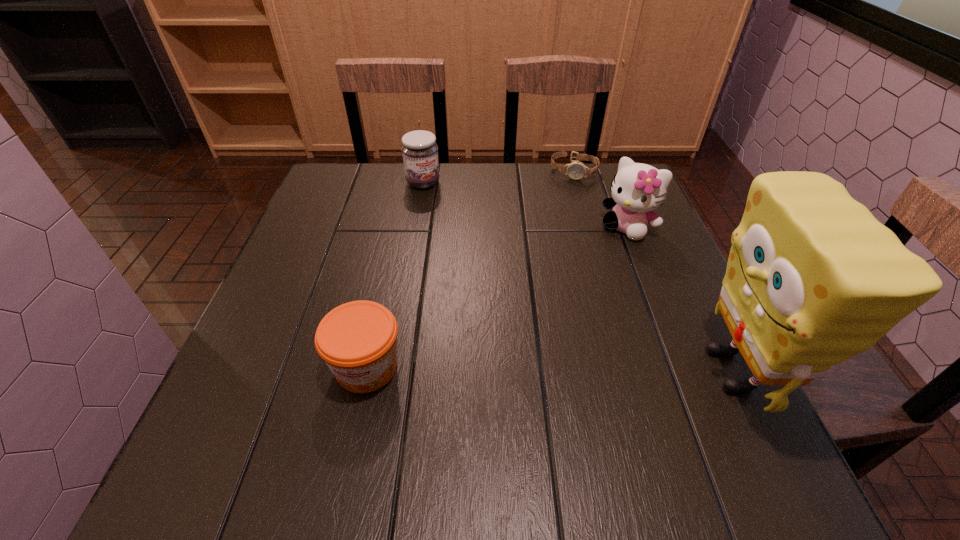
The width and height of the screenshot is (960, 540). Find the location of `free spot on the desktop that is between the fourth tallest object and the sponge and is positioned on the front-facing side of the third farthest object`. free spot on the desktop that is between the fourth tallest object and the sponge and is positioned on the front-facing side of the third farthest object is located at coordinates (508, 368).

Where is `free space on the desktop that is between the shorter jam and the tallest object and is positioned on the face of the watch`? free space on the desktop that is between the shorter jam and the tallest object and is positioned on the face of the watch is located at coordinates (528, 369).

At what (x,y) coordinates should I click in order to perform the action: click on free space on the desktop that is between the second shortest object and the sponge and is positioned on the front label of the third tallest object. Please return your answer as a coordinate pair (x, y). The height and width of the screenshot is (540, 960). Looking at the image, I should click on (592, 369).